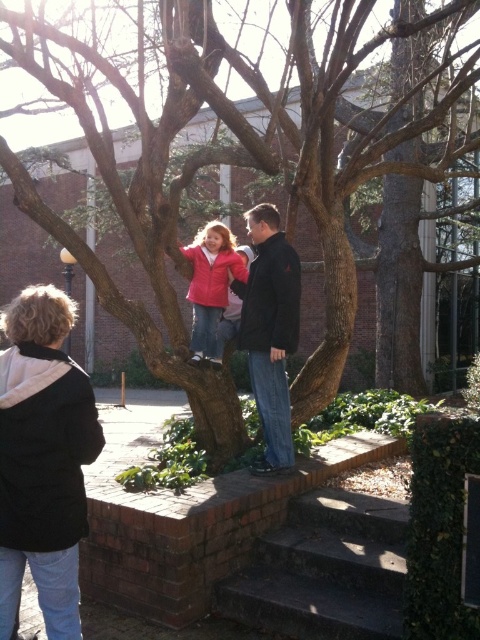
Question: Does black fleece jacket at lower left appear over black matte jacket at center?

Choices:
 (A) no
 (B) yes

Answer: (A)

Question: Can you confirm if black matte jacket at center is positioned to the left of matte red jacket at center?

Choices:
 (A) yes
 (B) no

Answer: (B)

Question: Which is nearer to the matte red jacket at center?

Choices:
 (A) black matte jacket at center
 (B) concrete stairs at lower center

Answer: (A)

Question: Which of the following is the farthest from the observer?

Choices:
 (A) matte red jacket at center
 (B) black fleece jacket at lower left
 (C) brown rough tree trunk at center
 (D) black matte jacket at center

Answer: (C)

Question: Considering the real-world distances, which object is closest to the black matte jacket at center?

Choices:
 (A) black fleece jacket at lower left
 (B) matte red jacket at center

Answer: (B)

Question: From the image, what is the correct spatial relationship of brown rough tree trunk at center in relation to black fleece jacket at lower left?

Choices:
 (A) above
 (B) below

Answer: (A)